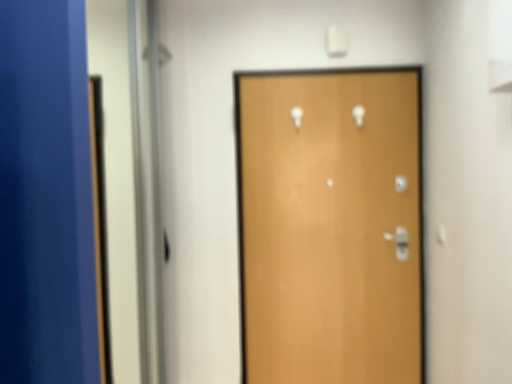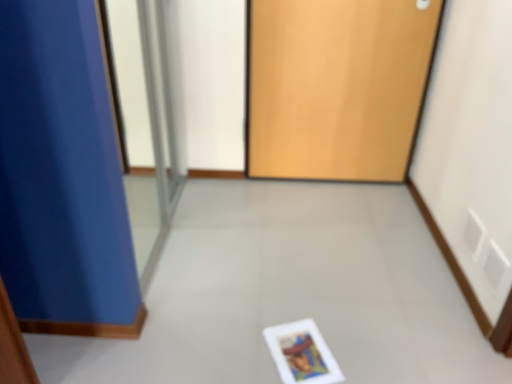
Question: How did the camera likely rotate when shooting the video?

Choices:
 (A) rotated upward
 (B) rotated downward

Answer: (B)